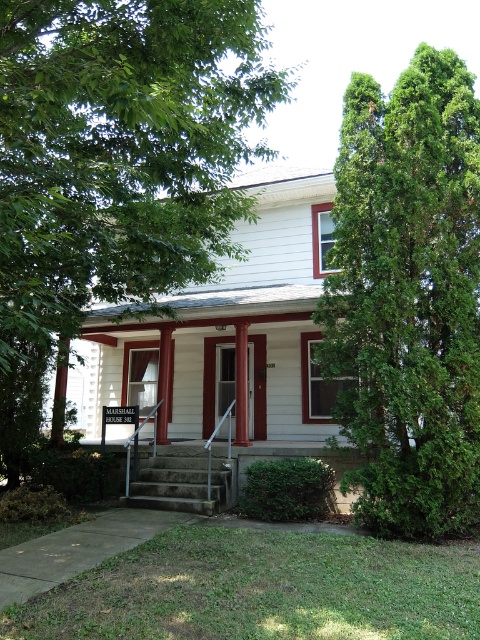
Is green textured evergreen tree at right smaller than smooth wood door at center?

No, green textured evergreen tree at right is not smaller than smooth wood door at center.

This screenshot has width=480, height=640. What do you see at coordinates (408, 296) in the screenshot?
I see `green textured evergreen tree at right` at bounding box center [408, 296].

Measure the distance between green textured evergreen tree at right and camera.

green textured evergreen tree at right is 5.84 meters from camera.

Locate an element on the screen. This screenshot has width=480, height=640. green textured evergreen tree at right is located at coordinates (408, 296).

Is concrete stairs at center to the right of smooth wood door at center from the viewer's perspective?

→ Incorrect, concrete stairs at center is not on the right side of smooth wood door at center.

Measure the distance between concrete stairs at center and camera.

concrete stairs at center and camera are 7.52 meters apart.

The image size is (480, 640). What are the coordinates of `concrete stairs at center` in the screenshot? It's located at (182, 481).

Is point (186, 51) farther from viewer compared to point (321, 308)?

No.

Is green leafy tree at upper right further to camera compared to green textured evergreen tree at right?

No, it is not.

Describe the element at coordinates (113, 166) in the screenshot. I see `green leafy tree at upper right` at that location.

I want to click on green leafy tree at upper right, so click(x=113, y=166).